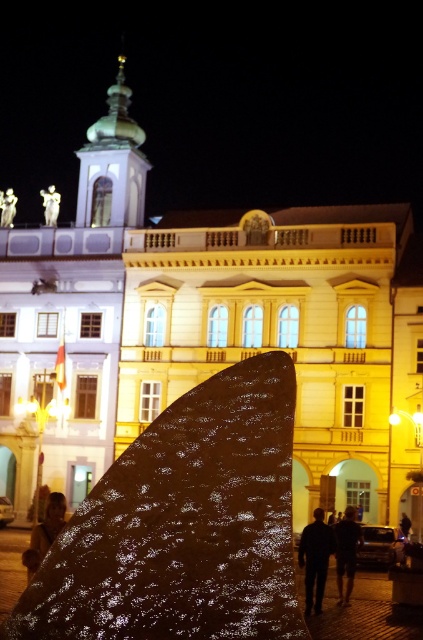
You are standing in front of the sculpture and want to take a photo of the brown leather jacket at lower left without the dark fabric pants at lower center blocking it. Is this possible?

The brown leather jacket at lower left is behind dark fabric pants at lower center, so it is blocked by them and cannot be photographed without the pants obstructing it.